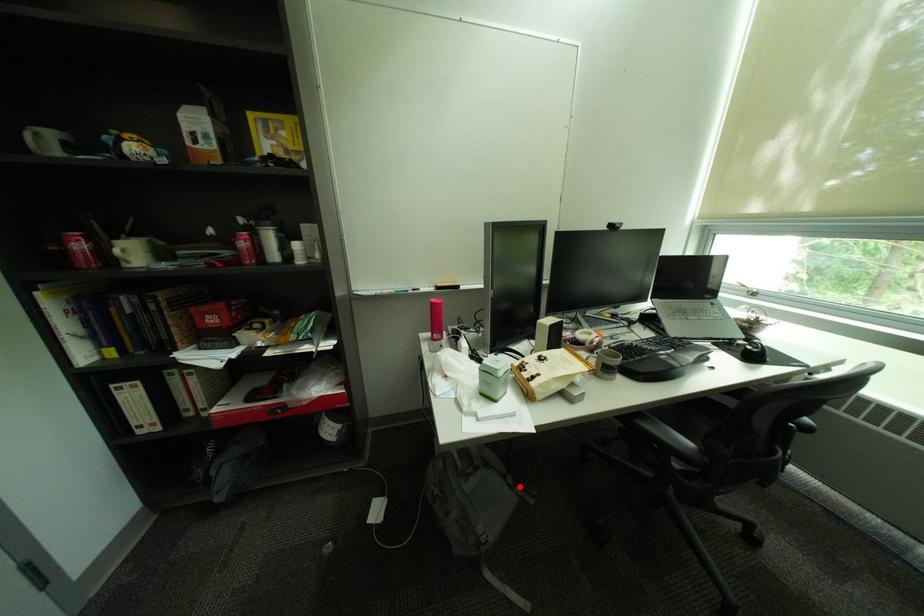
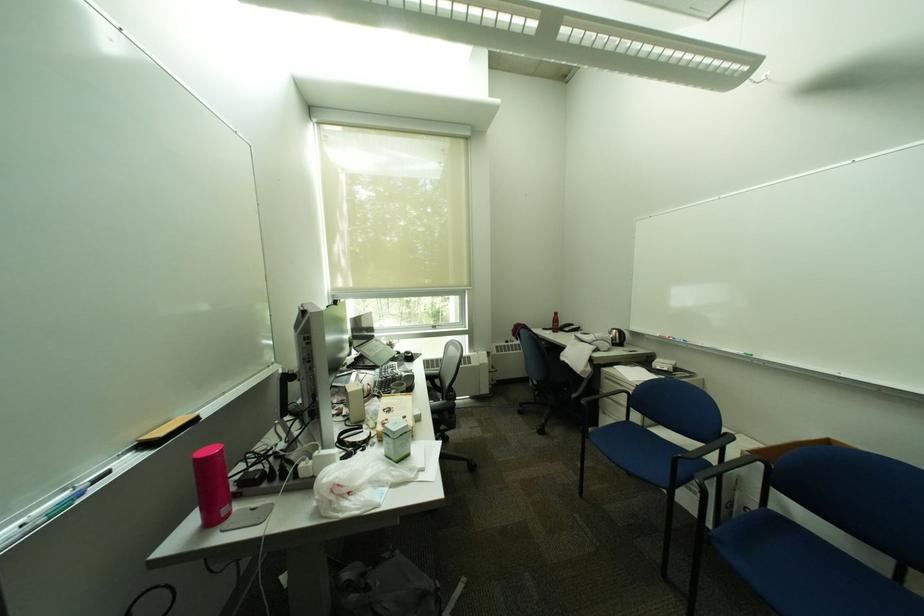
Question: I am providing you with two images of the same scene from different viewpoints. Given a red point in image1, look at the same physical point in image2. Is it:

Choices:
 (A) Closer to the viewpoint
 (B) Farther from the viewpoint

Answer: (A)